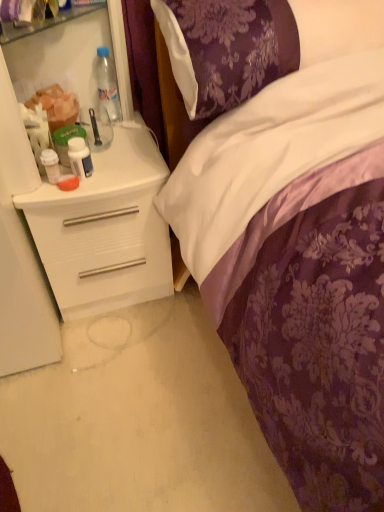
The image size is (384, 512). What are the coordinates of `free point in front of clear plastic bottle at upper left, the 3th bottle in the front-to-back sequence` in the screenshot? It's located at (119, 143).